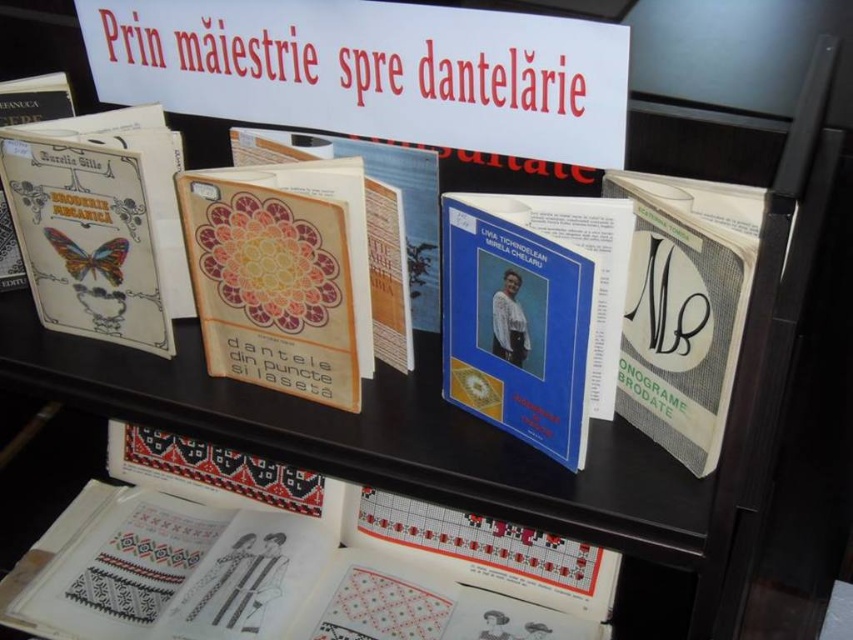
Question: Which of the following is the farthest from the observer?

Choices:
 (A) (488, 205)
 (B) (747, 296)
 (C) (432, 120)

Answer: (C)

Question: Considering the real-world distances, which object is closest to the white paper sign at upper center?

Choices:
 (A) white paper with black and red patterns at lower center
 (B) white mesh book at right
 (C) blue hardcover book at center
 (D) matte paper butterfly at left

Answer: (C)

Question: Can you confirm if white paper with black and red patterns at lower center is thinner than white mesh book at right?

Choices:
 (A) yes
 (B) no

Answer: (B)

Question: Among these objects, which one is farthest from the camera?

Choices:
 (A) white paper with black and red patterns at lower center
 (B) white mesh book at right

Answer: (A)

Question: From the image, what is the correct spatial relationship of blue hardcover book at center in relation to white mesh book at right?

Choices:
 (A) above
 (B) below

Answer: (B)

Question: Can you confirm if white paper sign at upper center is bigger than blue hardcover book at center?

Choices:
 (A) no
 (B) yes

Answer: (B)